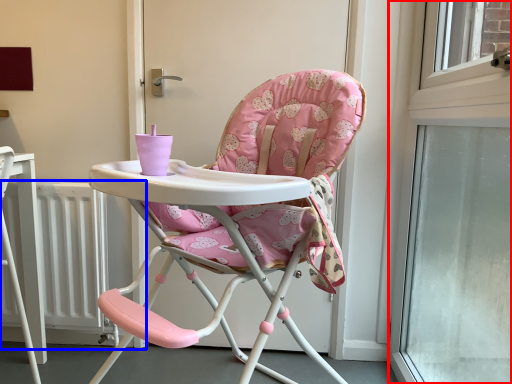
Question: Which object appears farthest to the camera in this image, window (highlighted by a red box) or radiator (highlighted by a blue box)?

Choices:
 (A) window
 (B) radiator

Answer: (B)